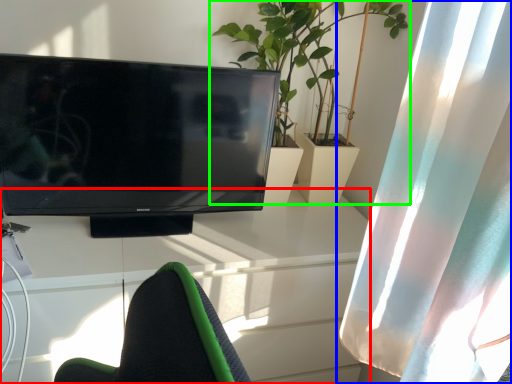
Question: Based on their relative distances, which object is nearer to desk (highlighted by a red box)? Choose from curtain (highlighted by a blue box) and houseplant (highlighted by a green box).

Choices:
 (A) curtain
 (B) houseplant

Answer: (A)